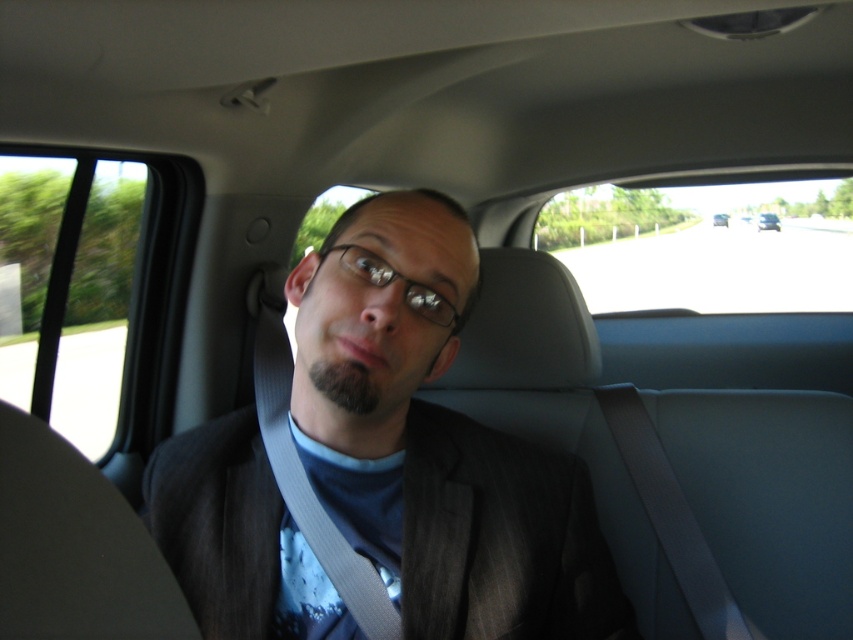
You are a fashion designer analyzing the car interior photo. You need to determine the exact position of the dark gray suit at center. What are its coordinates?

The dark gray suit at center is located at coordinates point (434, 442).

You are a fashion designer observing the car interior. You notice the dark gray suit at center and the metallic silver sedan at center. Which object is taller?

The dark gray suit at center is much taller than the metallic silver sedan at center.